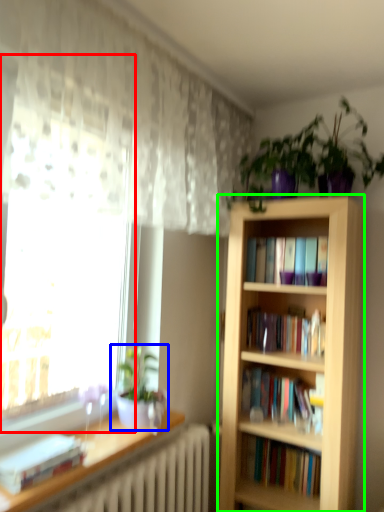
Question: Which is nearer to the bay window (highlighted by a red box)? houseplant (highlighted by a blue box) or bookcase (highlighted by a green box).

Choices:
 (A) houseplant
 (B) bookcase

Answer: (A)